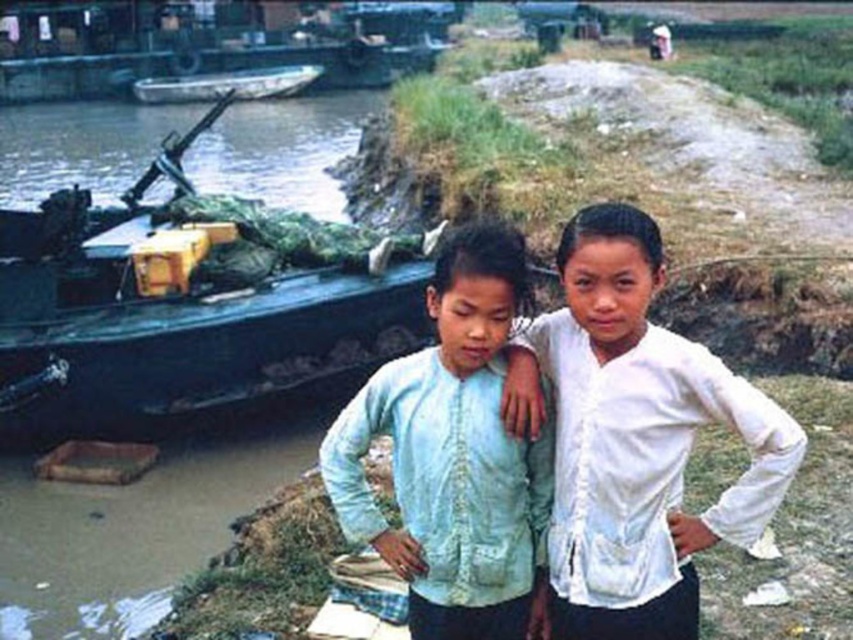
Question: Among these points, which one is farthest from the camera?

Choices:
 (A) pyautogui.click(x=196, y=396)
 (B) pyautogui.click(x=480, y=266)

Answer: (A)

Question: Can you confirm if green camouflage boat at left is positioned above metallic gray boat at upper left?

Choices:
 (A) no
 (B) yes

Answer: (A)

Question: Among these objects, which one is nearest to the camera?

Choices:
 (A) green camouflage boat at left
 (B) metallic gray boat at upper left

Answer: (A)

Question: Does light blue fabric shirt at center appear over metallic gray boat at upper left?

Choices:
 (A) yes
 (B) no

Answer: (B)

Question: Based on their relative distances, which object is nearer to the light blue fabric shirt at center?

Choices:
 (A) metallic gray boat at upper left
 (B) white matte shirt at center

Answer: (B)

Question: Is green camouflage boat at left to the right of light blue fabric shirt at center from the viewer's perspective?

Choices:
 (A) yes
 (B) no

Answer: (B)